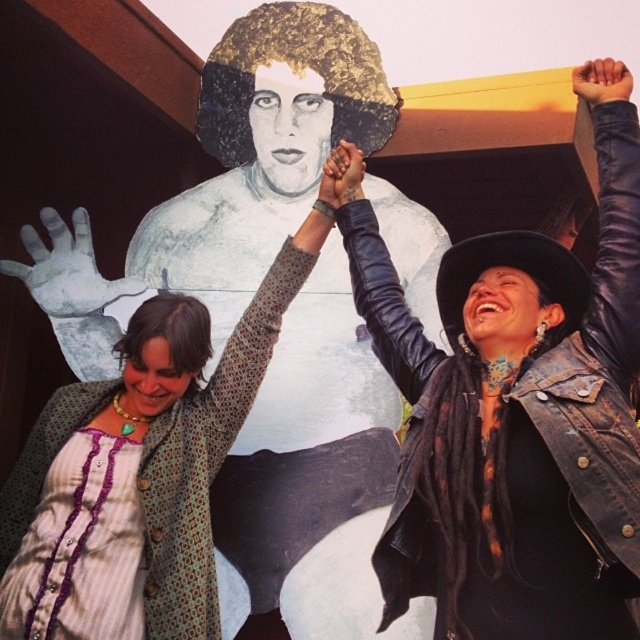
Question: Is leather jacket at upper right to the left of patterned fabric dress at upper left from the viewer's perspective?

Choices:
 (A) yes
 (B) no

Answer: (B)

Question: Which of these objects is positioned closest to the smooth leather hand at upper right?

Choices:
 (A) leather jacket at upper right
 (B) tattooed skin at center
 (C) patterned fabric dress at upper left

Answer: (A)

Question: Which of these objects is positioned closest to the patterned fabric dress at upper left?

Choices:
 (A) tattooed skin at center
 (B) leather jacket at upper right

Answer: (A)

Question: Can you confirm if smooth leather hand at upper right is positioned to the right of tattooed skin at center?

Choices:
 (A) no
 (B) yes

Answer: (B)

Question: Which point is closer to the camera?

Choices:
 (A) tattooed skin at center
 (B) smooth leather hand at upper right
 (C) leather jacket at upper right

Answer: (C)

Question: Where is leather jacket at upper right located in relation to smooth leather hand at upper right in the image?

Choices:
 (A) above
 (B) below

Answer: (B)